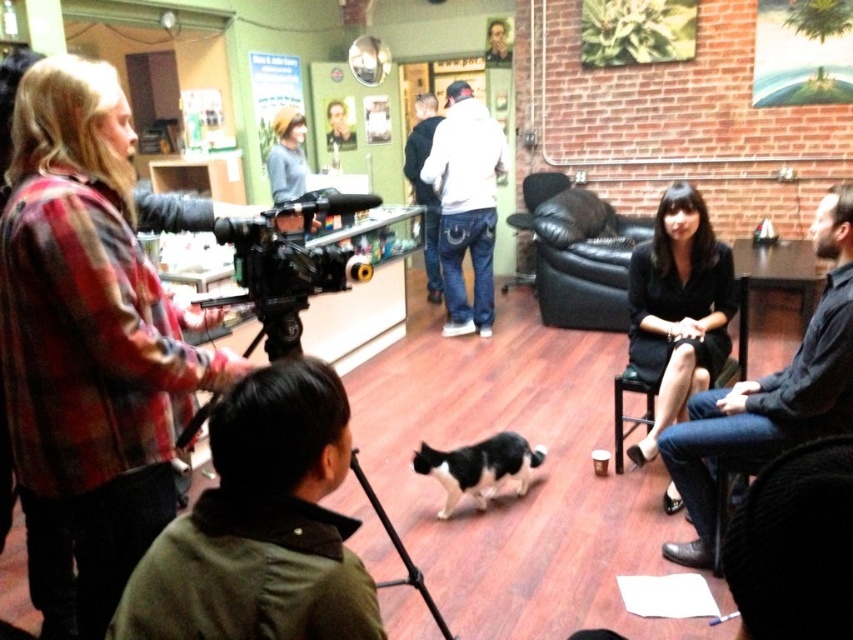
You are organizing a photoshoot in this space and need to place a large prop between the black satin dress at center and the black leather couch at center. Considering their sizes, which object should the prop be placed closer to?

The large prop should be placed closer to the black leather couch at center because the black satin dress at center occupies less space, making the area around it more limited compared to the larger space around the black leather couch at center.

You are a camera operator holding a camera that has a minimum focus distance of 1.5 meters. You are currently filming the black plastic video camera at left. Can you focus on it clearly?

The black plastic video camera at left is 1.68 meters away from camera, which is beyond the minimum focus distance of 1.5 meters, so yes, you can focus on it clearly.

You are a film director in the studio and want to ensure the black plastic video camera at left and the dark blue jeans at center are visible in the shot. Which object should be placed closer to the camera lens to ensure both are in frame?

The black plastic video camera at left is positioned on the left side of dark blue jeans at center. To ensure both are in frame, the dark blue jeans at center should be moved closer to the camera lens so that the black plastic video camera at left and dark blue jeans at center are within the shot.